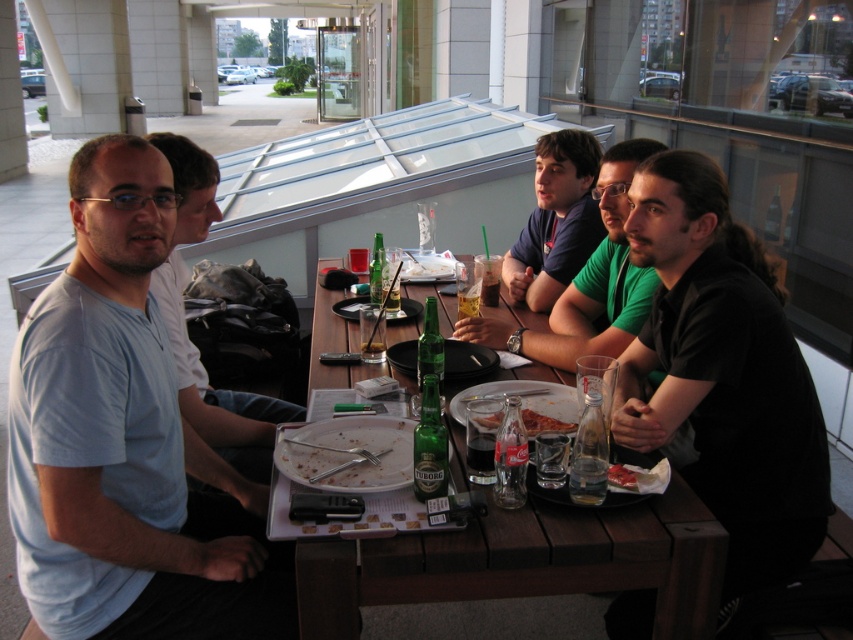
You are a waiter at this outdoor table. You need to place a new dish on the table. The dish is taller than the red tomato slice at center. Can you place it on the white porcelain plate at center?

The white porcelain plate at center is much taller than the red tomato slice at center. Since the dish is taller than the tomato slice, it can be placed on the white porcelain plate at center as it has sufficient height to accommodate it.

You are a waiter at the outdoor table. You need to deliver a dessert menu to the customer wearing the light blue cotton shirt at left. Which direction should you approach from relative to the dark blue shirt at center?

The light blue cotton shirt at left is below the dark blue shirt at center, so you should approach from below the dark blue shirt at center to reach the light blue cotton shirt at left.

You are a photographer at the scene and want to capture a closeup of the light blue cotton shirt at left. Based on its position, where should you aim your camera?

The light blue cotton shirt at left is located at coordinates point 0.691 on the x axis and 0.149 on the y axis, so you should aim your camera at that position to capture the closeup.